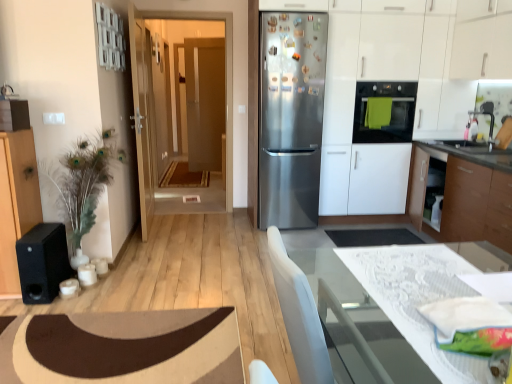
Question: In terms of height, does white lace table at lower right look taller or shorter compared to matte wooden door at center, acting as the 2th door starting from the front?

Choices:
 (A) short
 (B) tall

Answer: (A)

Question: From a real-world perspective, relative to matte wooden door at center, acting as the 2th door starting from the front, is white lace table at lower right vertically above or below?

Choices:
 (A) below
 (B) above

Answer: (A)

Question: Estimate the real-world distances between objects in this image. Which object is closer to the matte black oven at center right?

Choices:
 (A) matte wooden door at center, acting as the 2th door starting from the front
 (B) stainless steel refrigerator at center
 (C) brown carpet at lower left
 (D) wooden door at center, marked as the first door in a front-to-back arrangement
 (E) satin white cabinet at right

Answer: (E)

Question: Which is nearer to the matte black oven at center right?

Choices:
 (A) black matte speaker at left
 (B) wooden door at center, placed as the 2th door when sorted from back to front
 (C) white glossy countertop at lower right
 (D) stainless steel refrigerator at center
 (E) satin white cabinet at right

Answer: (E)